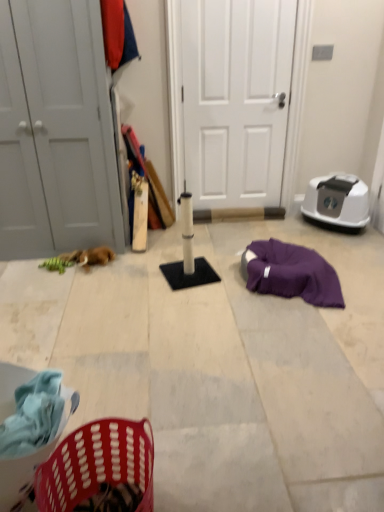
Question: Considering the positions of plastic laundry basket at lower left and white matte door at left, the 1th door positioned from the left, in the image, is plastic laundry basket at lower left taller or shorter than white matte door at left, the 1th door positioned from the left,?

Choices:
 (A) short
 (B) tall

Answer: (A)

Question: Is point (29, 479) closer or farther from the camera than point (62, 123)?

Choices:
 (A) closer
 (B) farther

Answer: (A)

Question: Which object is the closest to the plastic laundry basket at lower left?

Choices:
 (A) brown plush toy at left
 (B) white matte scratching post at center
 (C) white matte door at left, the 1th door positioned from the left
 (D) white matte door at center, the second door when ordered from left to right

Answer: (B)

Question: Estimate the real-world distances between objects in this image. Which object is closer to the white matte door at left, which appears as the 2th door when viewed from the right?

Choices:
 (A) white matte scratching post at center
 (B) white matte door at center, the 1th door in the right-to-left sequence
 (C) brown plush toy at left
 (D) plastic laundry basket at lower left

Answer: (C)